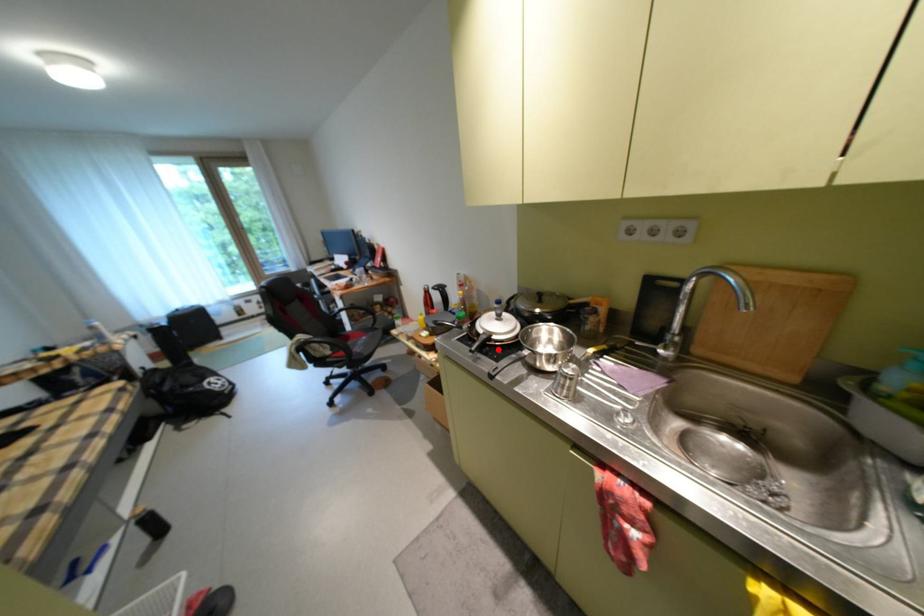
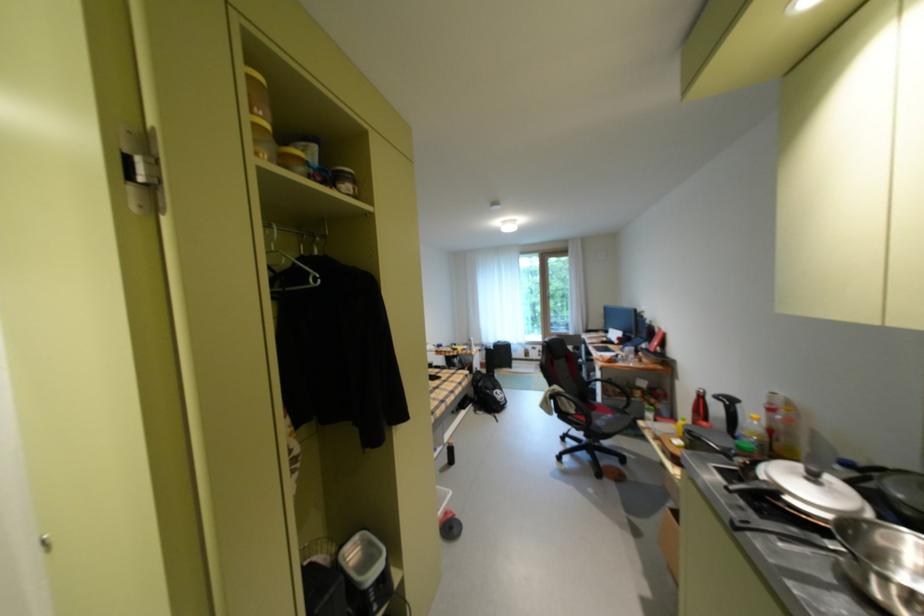
Question: I am providing you with two images of the same scene from different viewpoints. A red point is marked on the first image. Can you still see the location of the red point in image 2?

Choices:
 (A) Yes
 (B) No

Answer: (A)